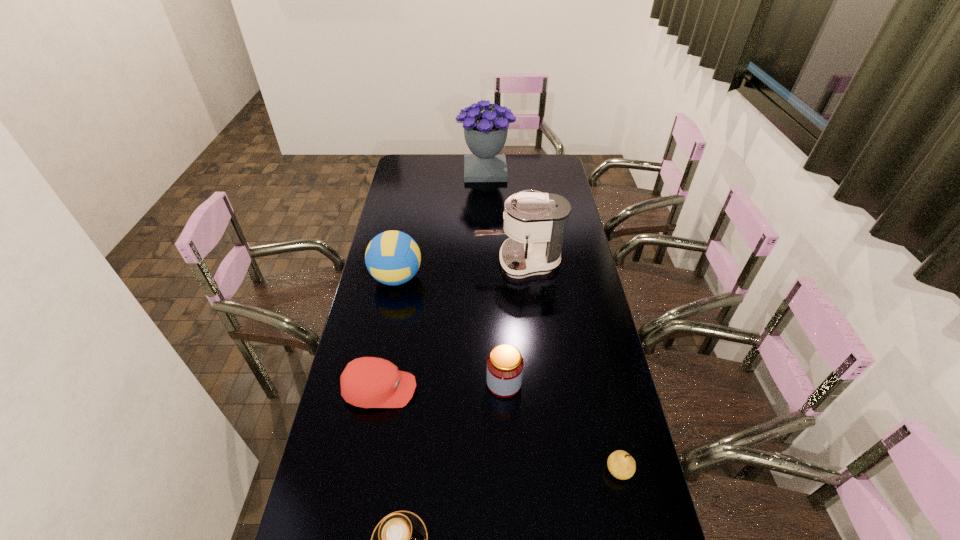
This screenshot has height=540, width=960. I want to click on vacant space located 0.140m on the front-facing side of the second tallest object, so click(441, 263).

This screenshot has width=960, height=540. What are the coordinates of `vacant space located 0.380m on the front-facing side of the second tallest object` in the screenshot? It's located at (382, 263).

The width and height of the screenshot is (960, 540). Identify the location of vacant space located on the back of the fifth shortest object. (403, 243).

Identify the location of free region located on the left of the fourth shortest object. (398, 383).

Identify the location of free region located 0.140m on the front-facing side of the cap. Image resolution: width=960 pixels, height=540 pixels. (462, 390).

Where is `free space located on the back of the pear`? free space located on the back of the pear is located at coordinates (611, 433).

Locate an element on the screen. Image resolution: width=960 pixels, height=540 pixels. object at the far edge is located at coordinates (485, 133).

The height and width of the screenshot is (540, 960). Identify the location of volleyball that is positioned at the left edge. (392, 257).

Where is `cap that is at the left edge`? cap that is at the left edge is located at coordinates (368, 382).

At what (x,y) coordinates should I click in order to perform the action: click on coffee maker situated at the right edge. Please return your answer as a coordinate pair (x, y). Looking at the image, I should click on (536, 223).